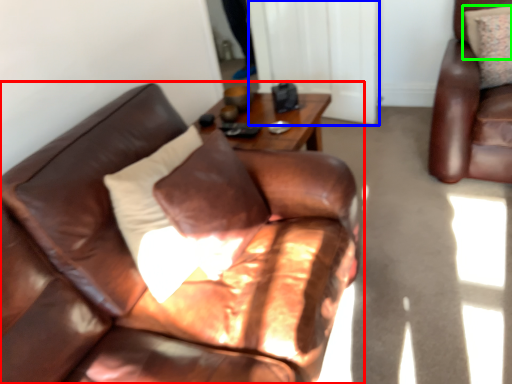
Question: Considering the real-world distances, which object is farthest from studio couch (highlighted by a red box)? glass door (highlighted by a blue box) or pillow (highlighted by a green box)?

Choices:
 (A) glass door
 (B) pillow

Answer: (B)